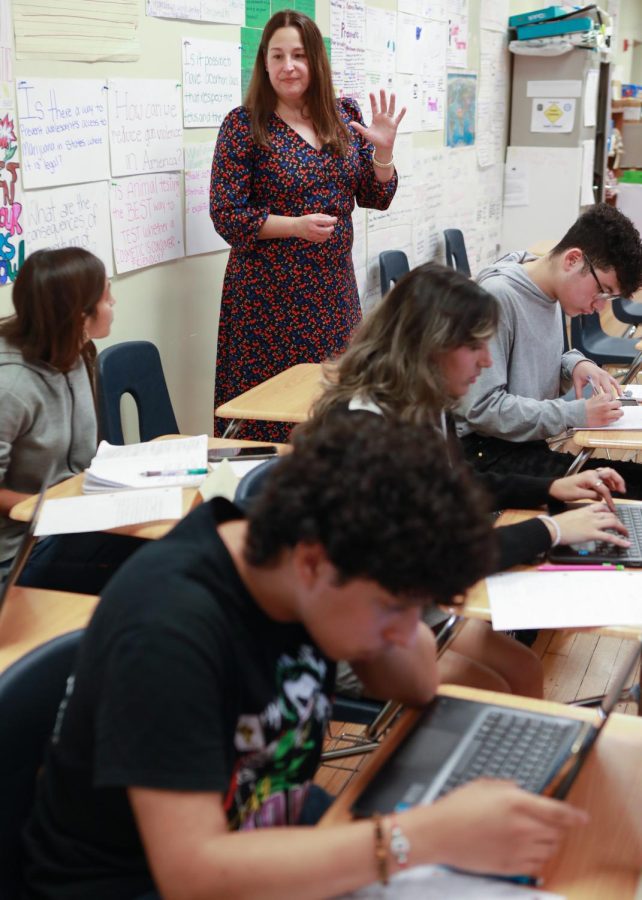
Where is `cabinet`? The height and width of the screenshot is (900, 642). cabinet is located at coordinates (524, 117).